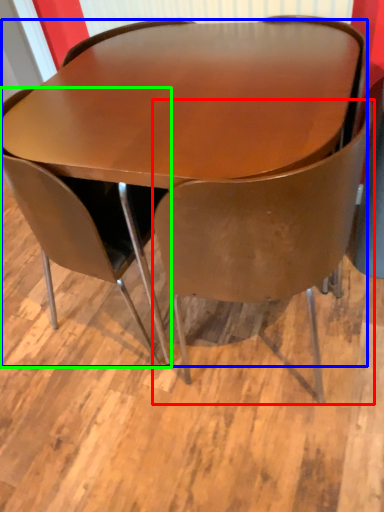
Question: Considering the real-world distances, which object is closest to chair (highlighted by a red box)? table (highlighted by a blue box) or chair (highlighted by a green box).

Choices:
 (A) table
 (B) chair

Answer: (A)